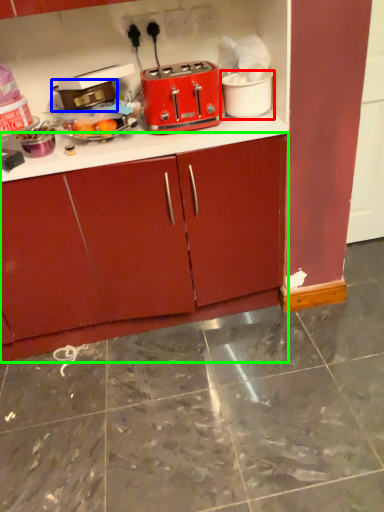
Question: Considering the real-world distances, which object is closest to appliance (highlighted by a red box)? appliance (highlighted by a blue box) or cabinetry (highlighted by a green box).

Choices:
 (A) appliance
 (B) cabinetry

Answer: (A)